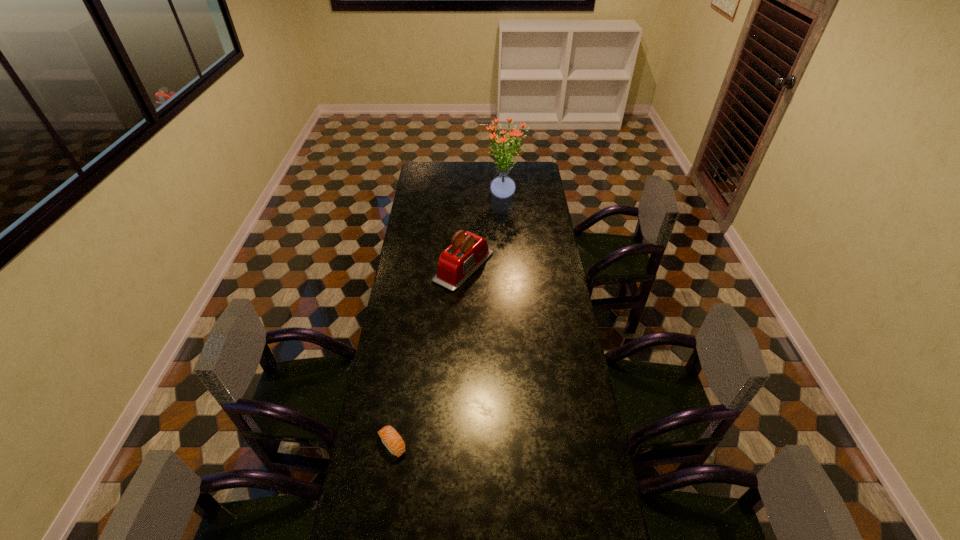
The width and height of the screenshot is (960, 540). In order to click on the farthest object in this screenshot , I will do `click(502, 187)`.

Locate an element on the screen. The height and width of the screenshot is (540, 960). the tallest object is located at coordinates (502, 187).

At what (x,y) coordinates should I click in order to perform the action: click on the second farthest object. Please return your answer as a coordinate pair (x, y). The width and height of the screenshot is (960, 540). Looking at the image, I should click on (468, 251).

Identify the location of the second tallest object. This screenshot has width=960, height=540. (468, 251).

Find the location of `the shortest object`. the shortest object is located at coordinates (391, 439).

Where is `the leftmost object`? Image resolution: width=960 pixels, height=540 pixels. the leftmost object is located at coordinates (391, 439).

The width and height of the screenshot is (960, 540). I want to click on vacant space located 0.290m on the front of the flower arrangement, so click(508, 241).

Where is `vacant point located 0.090m on the right of the second shortest object`? vacant point located 0.090m on the right of the second shortest object is located at coordinates (513, 267).

Locate an element on the screen. vacant space located on the right of the leftmost object is located at coordinates (518, 444).

Locate an element on the screen. Image resolution: width=960 pixels, height=540 pixels. object situated at the left edge is located at coordinates (391, 439).